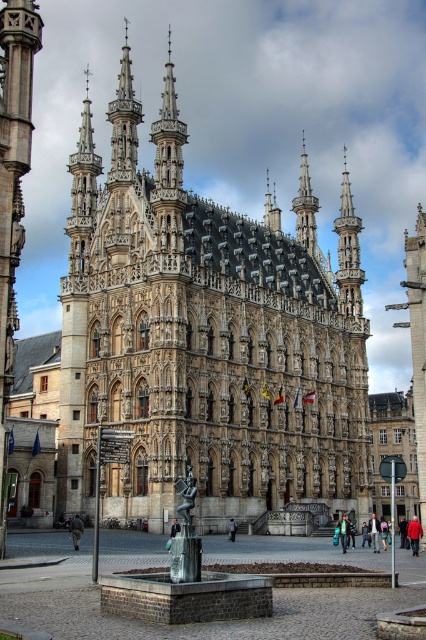
You are an architect visiting this historic site and want to determine which structure is taller between the stone gothic church at center and the brick fountain at center. Based on the image, which one is taller?

The stone gothic church at center is taller than the brick fountain at center according to the description provided.

You are an architect planning to add a new sculpture between the stone gothic church at center and the brick fountain at center. Which structure should the sculpture be closer to if it needs to be proportionally balanced with their sizes?

The sculpture should be closer to the brick fountain at center because the stone gothic church at center is bigger, so placing the sculpture closer to the smaller brick fountain at center will create a balanced proportion between the two structures.